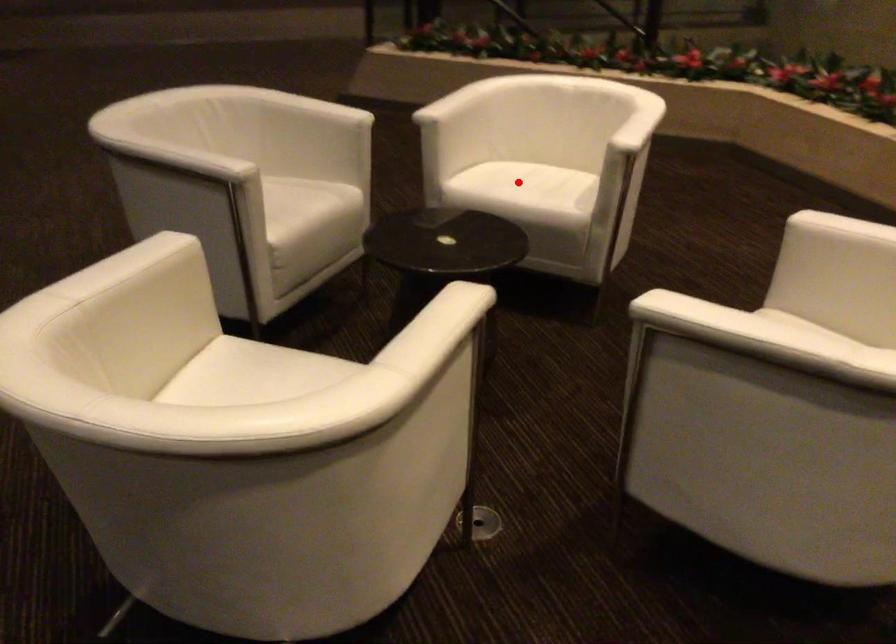
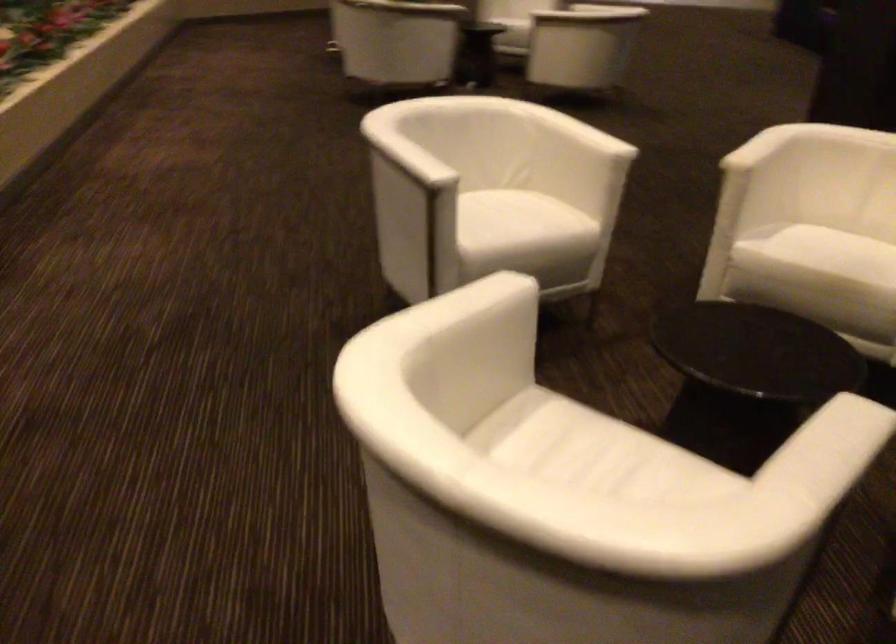
Where in the second image is the point corresponding to the highlighted location from the first image?

(616, 462)